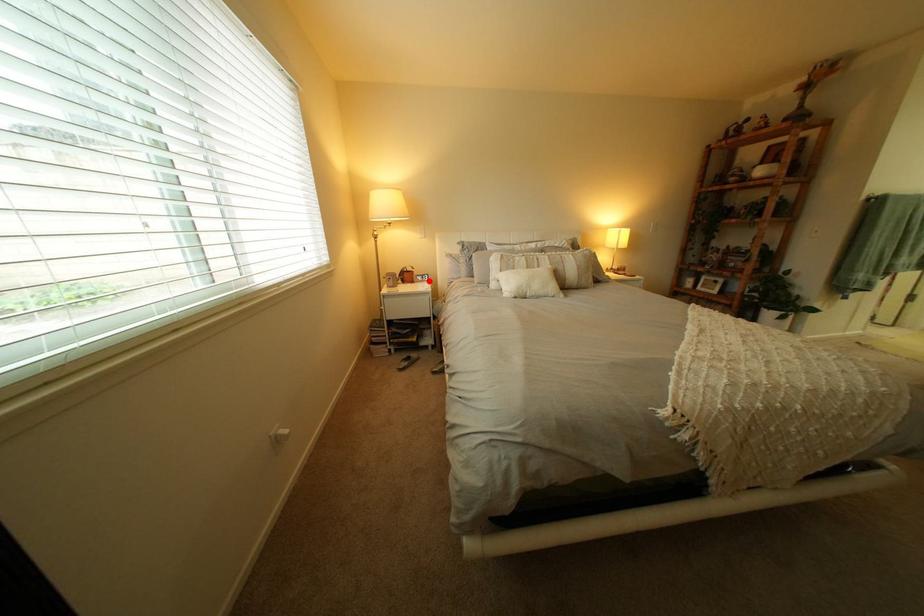
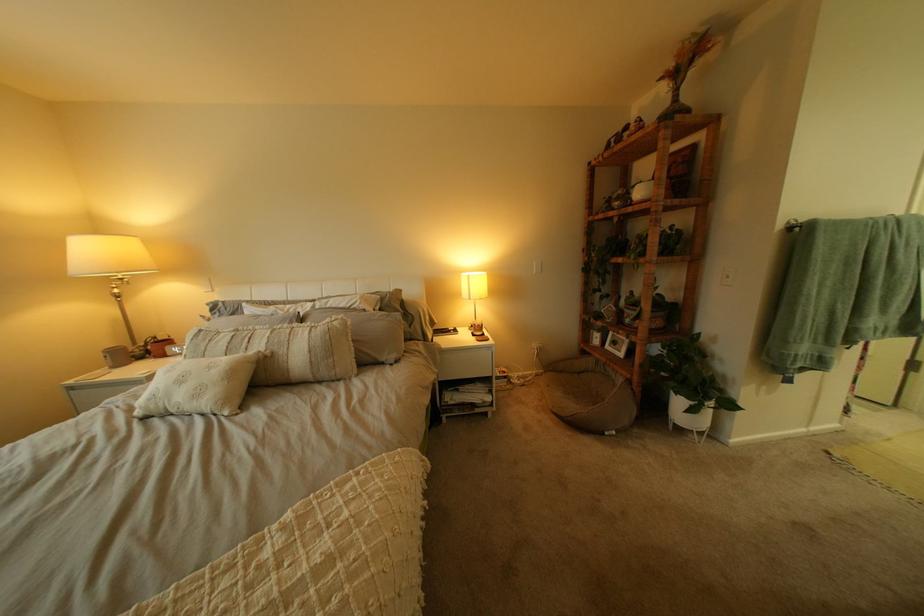
In the second image, find the point that corresponds to the highlighted location in the first image.

(180, 354)